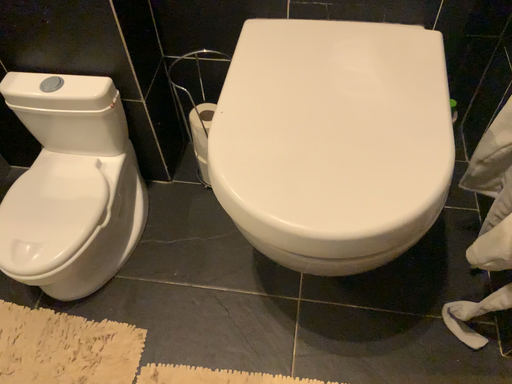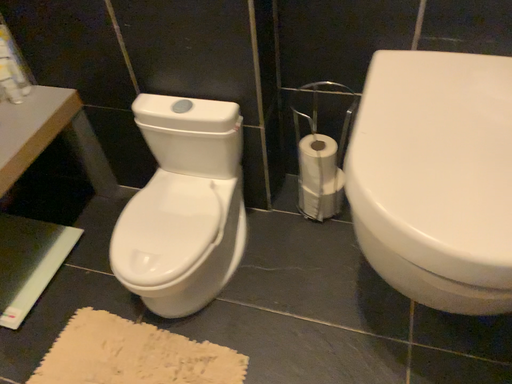
Question: Which way did the camera rotate in the video?

Choices:
 (A) rotated left
 (B) rotated right

Answer: (A)